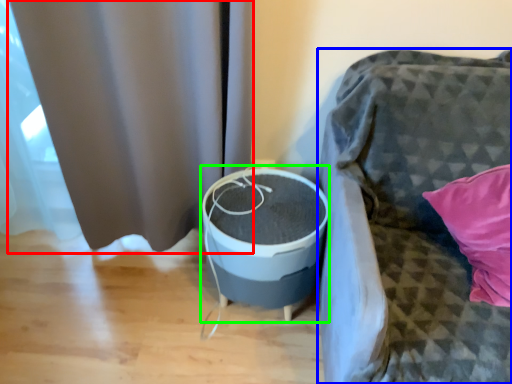
Question: Which object is the farthest from curtain (highlighted by a red box)? Choose among these: furniture (highlighted by a blue box) or round table (highlighted by a green box).

Choices:
 (A) furniture
 (B) round table

Answer: (A)